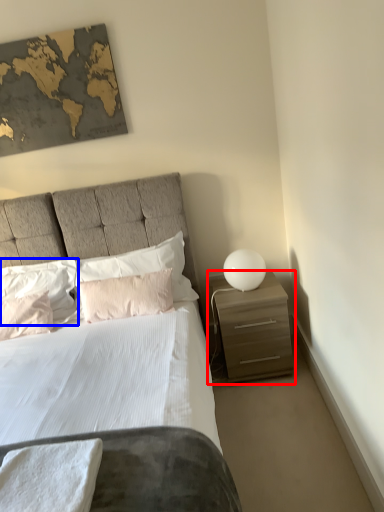
Question: Among these objects, which one is farthest to the camera, nightstand (highlighted by a red box) or pillow (highlighted by a blue box)?

Choices:
 (A) nightstand
 (B) pillow

Answer: (B)